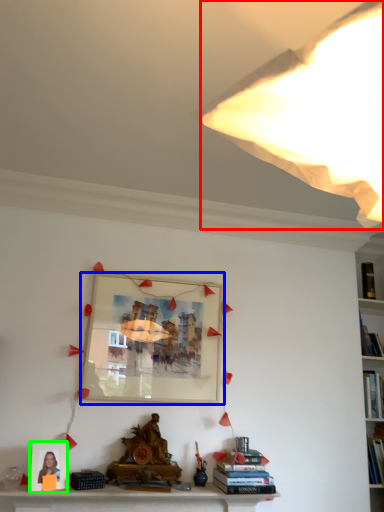
Question: Which object is the farthest from light (highlighted by a red box)? Choose among these: picture frame (highlighted by a blue box) or picture frame (highlighted by a green box).

Choices:
 (A) picture frame
 (B) picture frame

Answer: (B)